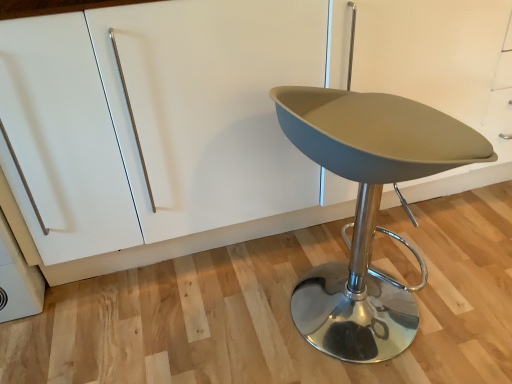
Where is `free point below matte gray stool at center (from a real-world perspective)`? This screenshot has height=384, width=512. free point below matte gray stool at center (from a real-world perspective) is located at coordinates (368, 339).